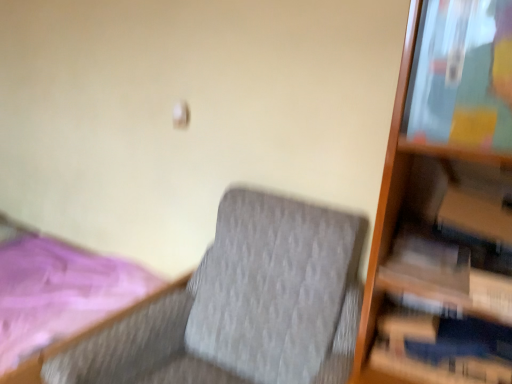
Question: Is white matte paperback book at right bigger or smaller than textured gray fabric rocking chair at center?

Choices:
 (A) small
 (B) big

Answer: (A)

Question: Visually, is white matte paperback book at right positioned to the left or to the right of textured gray fabric rocking chair at center?

Choices:
 (A) right
 (B) left

Answer: (A)

Question: Estimate the real-world distances between objects in this image. Which object is farther from the pink fabric bed at lower left?

Choices:
 (A) white matte paperback book at right
 (B) textured gray fabric rocking chair at center

Answer: (A)

Question: Based on their relative distances, which object is nearer to the white matte paperback book at right?

Choices:
 (A) textured gray fabric rocking chair at center
 (B) pink fabric bed at lower left

Answer: (A)